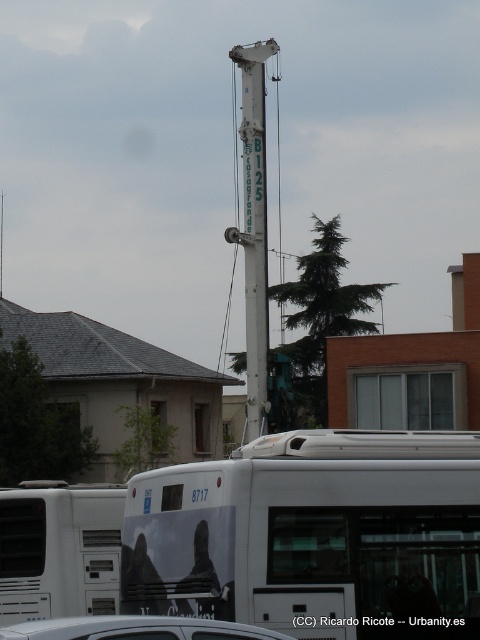
From the picture: Who is positioned more to the left, white matte bus at center or silver metallic car at lower center?

silver metallic car at lower center is more to the left.

Between point (159, 588) and point (36, 636), which one is positioned in front?

Point (36, 636)

Who is more forward, (158,557) or (177,616)?

Positioned in front is point (177,616).

Find the location of `white matte bus at center`. white matte bus at center is located at coordinates (313, 536).

Between white painted metal pole at center and silver metallic car at lower center, which one appears on the right side from the viewer's perspective?

Positioned to the right is silver metallic car at lower center.

Is white painted metal pole at center shorter than silver metallic car at lower center?

Incorrect, white painted metal pole at center's height does not fall short of silver metallic car at lower center's.

Is point (244, 122) farther from camera compared to point (84, 630)?

Yes, it is.

You are a GUI agent. You are given a task and a screenshot of the screen. Output one action in this format:
    pyautogui.click(x=<x>, y=<y>)
    Task: Click on the white painted metal pole at center
    The width and height of the screenshot is (480, 640).
    Given the screenshot: What is the action you would take?
    pyautogui.click(x=253, y=225)

Is the position of white matte bus at center more distant than that of white painted metal pole at center?

No, white matte bus at center is in front of white painted metal pole at center.

I want to click on white matte bus at center, so click(313, 536).

Does point (396, 620) come closer to viewer compared to point (235, 49)?

Yes, it is in front of point (235, 49).

At what (x,y) coordinates should I click in order to perform the action: click on white matte bus at center. Please return your answer as a coordinate pair (x, y). Image resolution: width=480 pixels, height=640 pixels. Looking at the image, I should click on (313, 536).